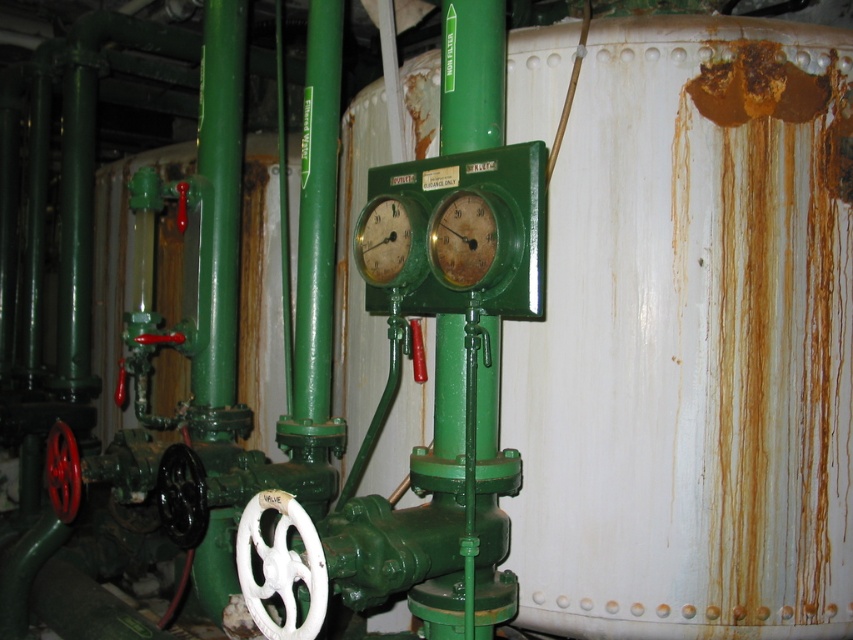
You are an engineer inspecting the machinery and need to read the measurements on both the rusty metal gauge at center and the green matte gauge at center. Which gauge can you see more clearly from your current position?

The rusty metal gauge at center is closer to the viewer than the green matte gauge at center, so you can see the rusty metal gauge at center more clearly.

You are an engineer inspecting the machinery and need to compare the height of the rusty metal gauge at center and the green matte gauge at center. Which one is taller?

The green matte gauge at center is taller than the rusty metal gauge at center.

You are a technician standing in front of the industrial machinery. You need to read the numbers on the rusty metal gauge at center. Can you read them without moving closer? Please explain your reasoning.

The rusty metal gauge at center and camera are 1.41 meters apart. Since the distance is fixed, you cannot read the numbers clearly without moving closer to the gauge.